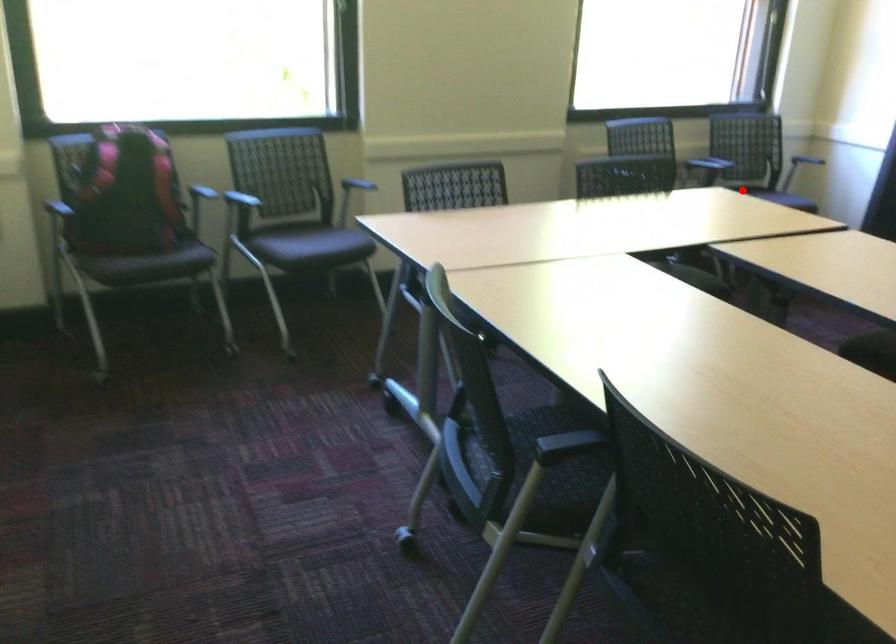
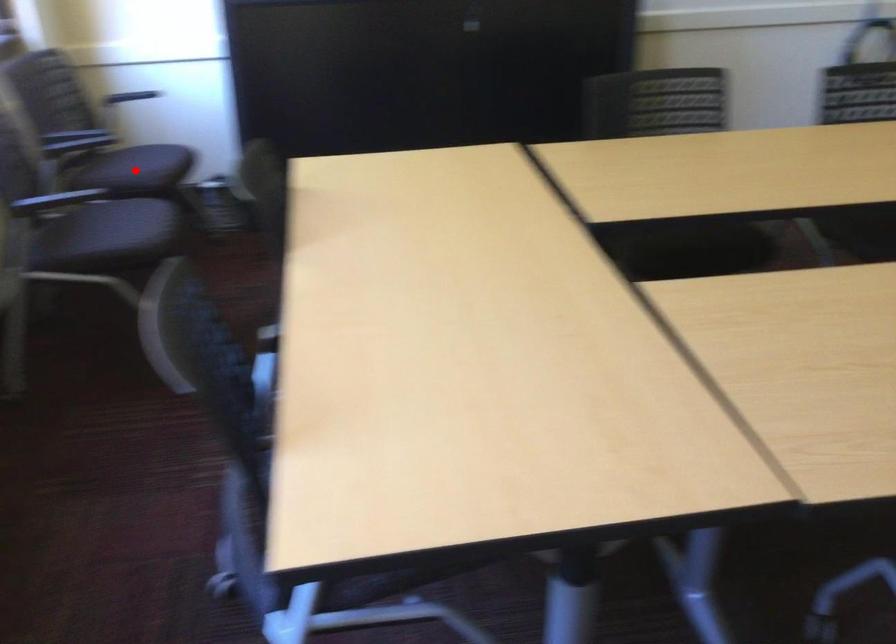
I am providing you with two images of the same scene from different viewpoints. A red point is marked on the first image and another point is marked on the second image. Are the points marked in image1 and image2 representing the same 3D position?

Yes